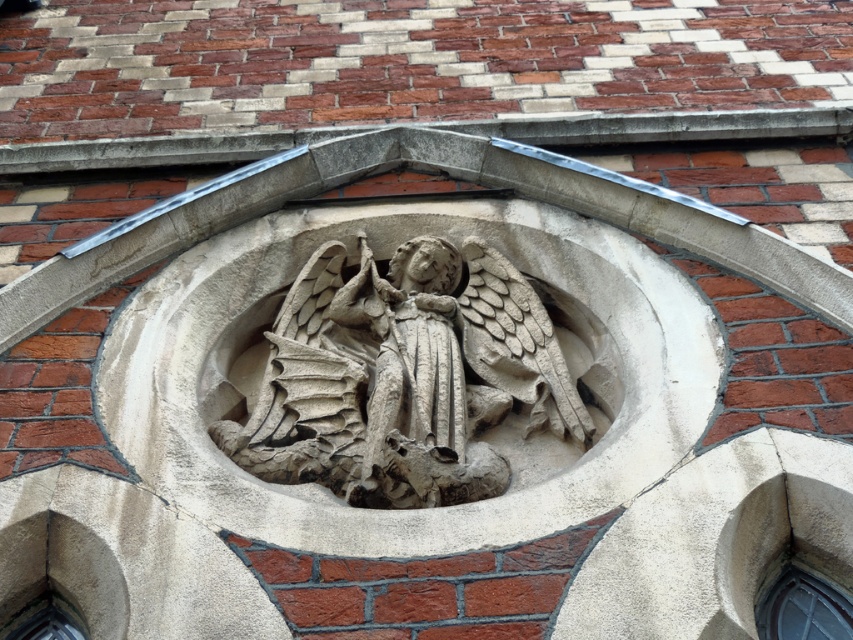
You are an architect assessing the building facade. You notice the gray stone angel at center and the transparent glass window at lower left. Which object would cast a more prominent shadow during midday sunlight?

The gray stone angel at center is larger in size than the transparent glass window at lower left, so it would cast a more prominent shadow during midday sunlight.

You are an architect inspecting the building facade. You notice the clear glass window at lower right and the transparent glass window at lower left. Which window is placed higher up on the wall?

The clear glass window at lower right is positioned over the transparent glass window at lower left, meaning it is higher up on the wall.

You are an architect examining the building exterior. You need to install a protective cover over the gray stone angel at center and the clear glass window at lower right. Based on their positions, which object is closer to the left edge of the niche?

The gray stone angel at center is positioned on the left side of clear glass window at lower right, so it is closer to the left edge of the niche.